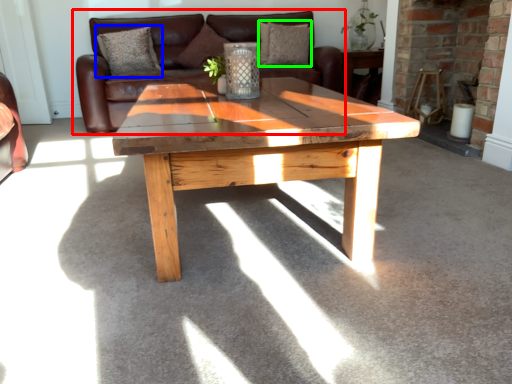
Question: Which object is the closest to the studio couch (highlighted by a red box)? Choose among these: pillow (highlighted by a blue box) or pillow (highlighted by a green box).

Choices:
 (A) pillow
 (B) pillow

Answer: (A)